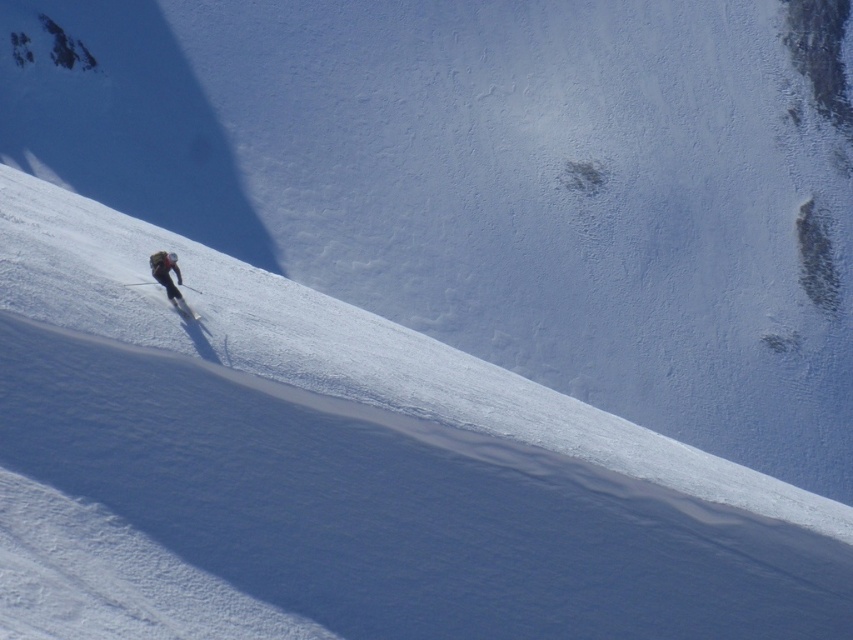
You are a snowboarder planning to descend the slope. You see the white powder snow at center and the matte black snowboarder at lower left. How far apart are these two points on the slope?

The distance between the white powder snow at center and the matte black snowboarder at lower left is 33.80 feet.

You are a mountain guide planning a safe path for a beginner skier. The beginner wants to start from the matte black ski at lower left and move towards the white powder snow at center. Given that the safe distance for a beginner to maintain between obstacles is at least 10 meters, is the current path safe?

The distance between the white powder snow at center and the matte black ski at lower left is 8.66 meters, which is less than the required 10 meters for a safe path. Therefore, the current path is not safe for a beginner skier.